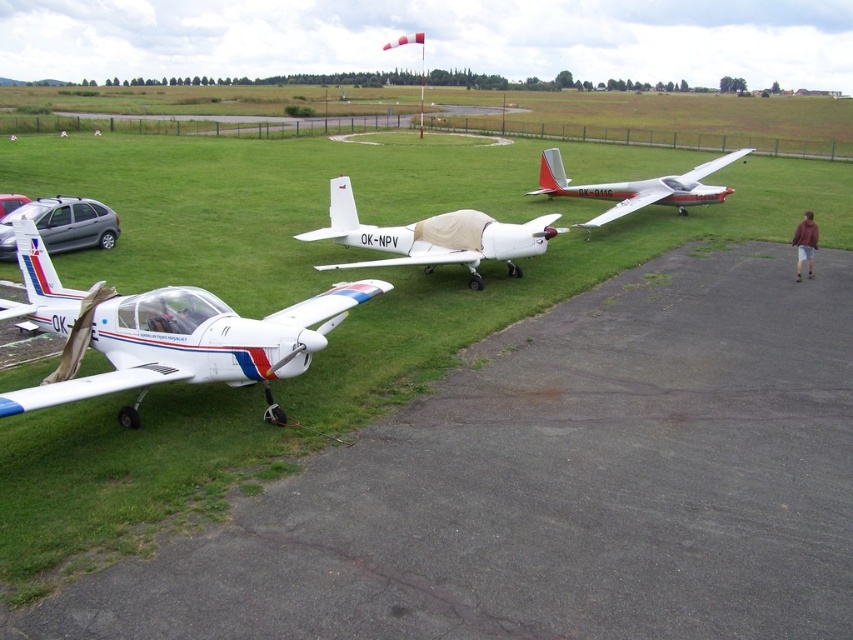
Question: Considering the real-world distances, which object is closest to the white matte airplane at left?

Choices:
 (A) white matte glider at center
 (B) white matte airplane at center

Answer: (B)

Question: Does white matte airplane at left have a smaller size compared to silver metallic car at left?

Choices:
 (A) yes
 (B) no

Answer: (B)

Question: Is white matte glider at center further to the viewer compared to silver metallic hatchback at left?

Choices:
 (A) yes
 (B) no

Answer: (A)

Question: Which point appears farthest from the camera in this image?

Choices:
 (A) (799, 266)
 (B) (77, 228)
 (C) (693, 173)
 (D) (511, 227)

Answer: (C)

Question: Does white matte airplane at left appear on the right side of white matte airplane at center?

Choices:
 (A) yes
 (B) no

Answer: (B)

Question: Which is nearer to the silver metallic car at left?

Choices:
 (A) white matte glider at center
 (B) white matte airplane at center

Answer: (B)